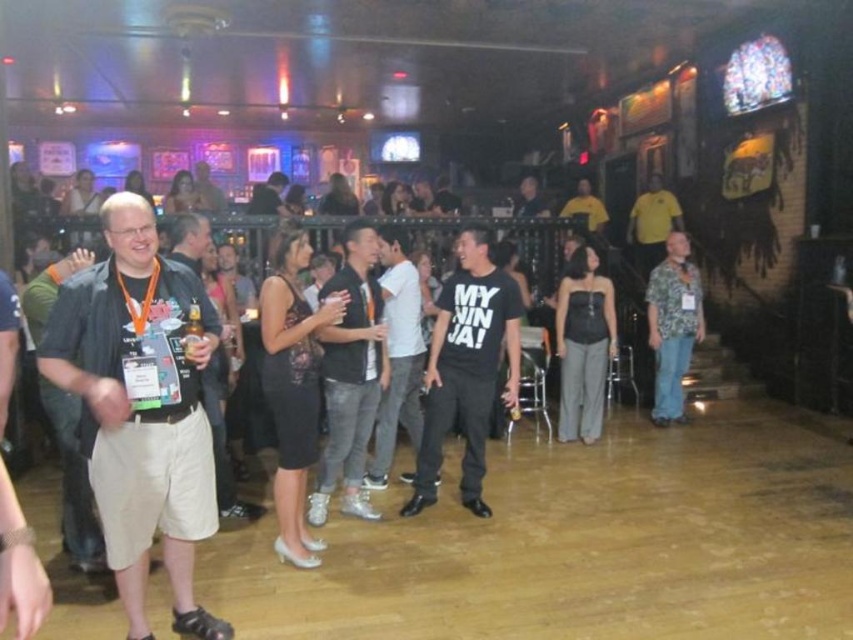
Does dark gray shirt at left lie behind matte black t-shirt at center?

No.

Consider the image. Between dark gray shirt at left and matte black t-shirt at center, which one is positioned higher?

matte black t-shirt at center

Is point (115, 404) positioned before point (170, 225)?

Yes.

Identify the location of dark gray shirt at left. This screenshot has height=640, width=853. (141, 406).

Is white matte shirt at center below yellow cotton shirt at upper right?

Yes.

Can you confirm if white matte shirt at center is bigger than yellow cotton shirt at upper right?

Correct, white matte shirt at center is larger in size than yellow cotton shirt at upper right.

In order to click on white matte shirt at center in this screenshot , I will do `click(397, 355)`.

What are the coordinates of `white matte shirt at center` in the screenshot? It's located at (397, 355).

Who is positioned more to the left, black matte t-shirt at center or hawaiian print shirt at right?

Positioned to the left is black matte t-shirt at center.

Is black matte t-shirt at center closer to camera compared to hawaiian print shirt at right?

Yes, it is in front of hawaiian print shirt at right.

Where is `black matte t-shirt at center`? The height and width of the screenshot is (640, 853). black matte t-shirt at center is located at coordinates (466, 369).

You are a GUI agent. You are given a task and a screenshot of the screen. Output one action in this format:
    pyautogui.click(x=<x>, y=<y>)
    Task: Click on the black matte t-shirt at center
    
    Given the screenshot: What is the action you would take?
    pyautogui.click(x=466, y=369)